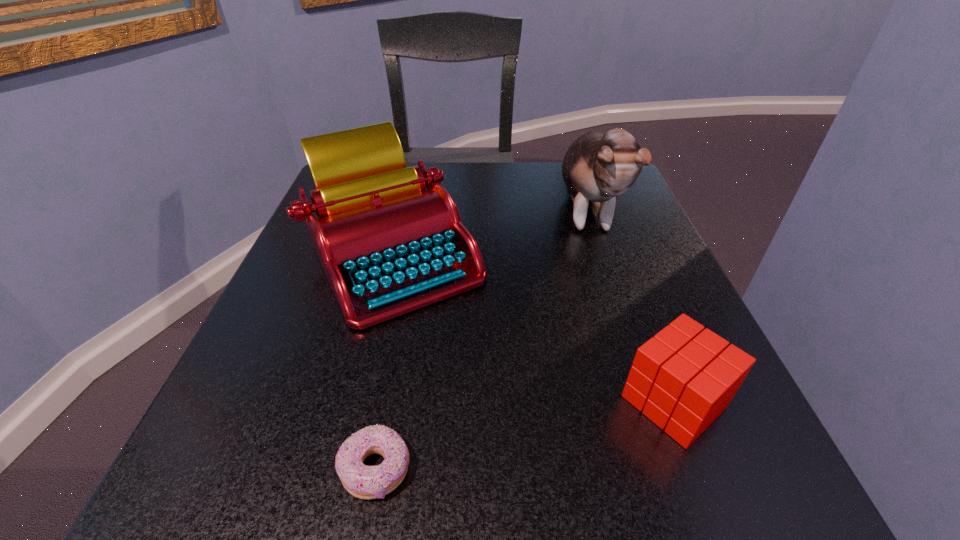
Locate an element on the screen. The width and height of the screenshot is (960, 540). the tallest object is located at coordinates (597, 167).

What are the coordinates of `the third shortest object` in the screenshot? It's located at (389, 237).

Locate an element on the screen. cube is located at coordinates (683, 378).

Locate an element on the screen. The height and width of the screenshot is (540, 960). the shortest object is located at coordinates (366, 482).

I want to click on vacant space located at the face of the tallest object, so click(x=616, y=307).

I want to click on free space located 0.200m on the typing side of the typewriter, so click(x=344, y=458).

Locate an element on the screen. free space located on the back of the cube is located at coordinates (601, 210).

Locate an element on the screen. The width and height of the screenshot is (960, 540). free location located 0.350m on the right of the shortest object is located at coordinates point(710,469).

Locate an element on the screen. The height and width of the screenshot is (540, 960). cat at the far edge is located at coordinates (597, 167).

This screenshot has width=960, height=540. I want to click on typewriter present at the far edge, so click(x=389, y=237).